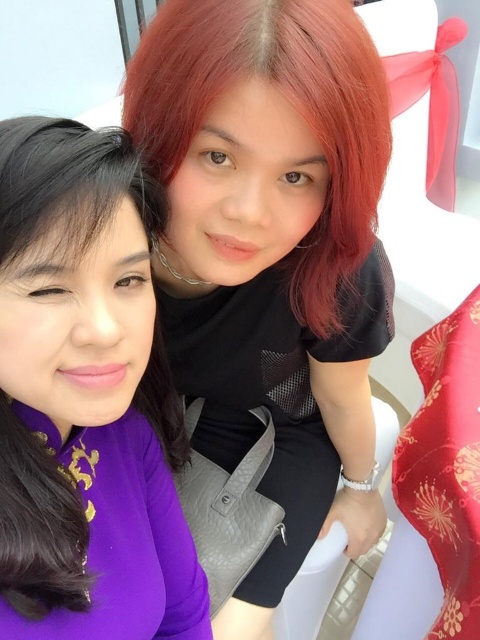
Question: Which of the following is the farthest from the observer?

Choices:
 (A) shiny red hair at upper center
 (B) matte black hair at upper right

Answer: (A)

Question: Which point is farther to the camera?

Choices:
 (A) shiny red hair at upper center
 (B) matte black hair at upper right

Answer: (A)

Question: Does matte black hair at upper right have a greater width compared to shiny red hair at upper center?

Choices:
 (A) yes
 (B) no

Answer: (B)

Question: Is the position of matte black hair at upper right less distant than that of shiny red hair at upper center?

Choices:
 (A) yes
 (B) no

Answer: (A)

Question: Does matte black hair at upper right lie in front of shiny red hair at upper center?

Choices:
 (A) yes
 (B) no

Answer: (A)

Question: Which of the following is the closest to the observer?

Choices:
 (A) shiny red hair at upper center
 (B) matte black hair at upper right

Answer: (B)